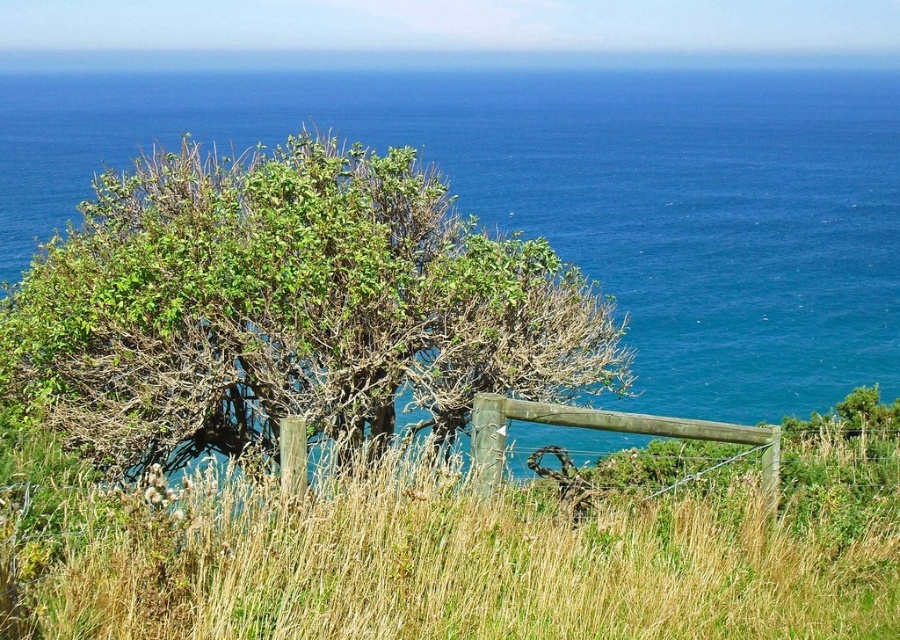
Where is `green grass at center`? The height and width of the screenshot is (640, 900). green grass at center is located at coordinates (448, 554).